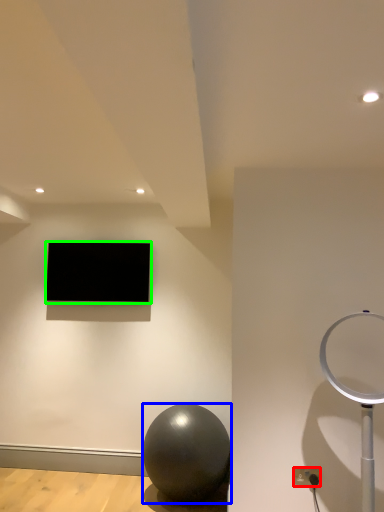
Question: Considering the real-world distances, which object is farthest from electric outlet (highlighted by a red box)? ball (highlighted by a blue box) or television (highlighted by a green box)?

Choices:
 (A) ball
 (B) television

Answer: (B)